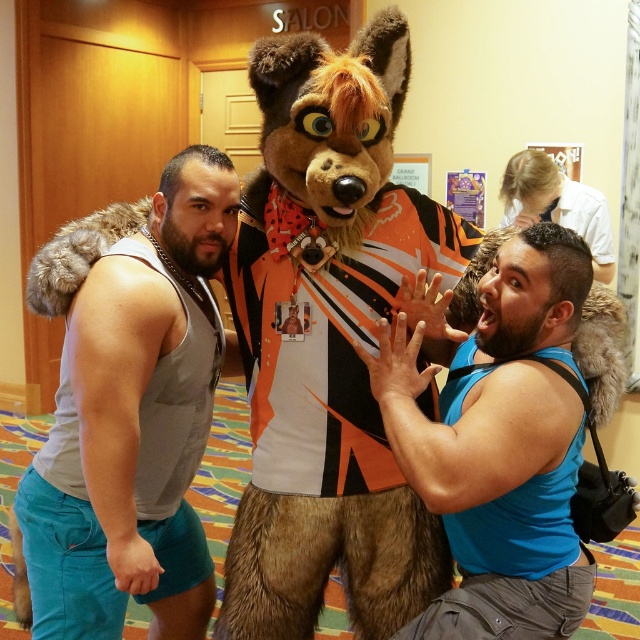
You are standing in the convention center and see the point marked at coordinates (x=500, y=445). What object is this point located on?

The point at (x=500, y=445) is located on the blue fabric shirt at center.